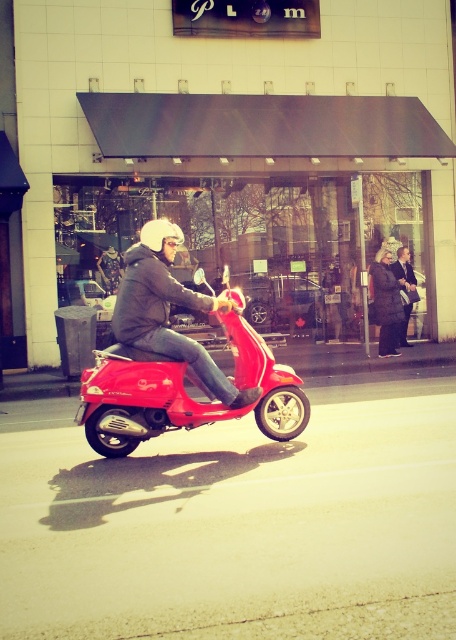
Which is more to the left, dark gray wool coat at center or leather jacket at center?

From the viewer's perspective, dark gray wool coat at center appears more on the left side.

Does dark gray wool coat at center have a larger size compared to leather jacket at center?

Correct, dark gray wool coat at center is larger in size than leather jacket at center.

Locate an element on the screen. dark gray wool coat at center is located at coordinates (387, 301).

Consider the image. Can you confirm if shiny red scooter at center is smaller than dark gray wool coat at center?

Correct, shiny red scooter at center occupies less space than dark gray wool coat at center.

Is shiny red scooter at center in front of dark gray wool coat at center?

That is True.

Find the location of a particular element. This screenshot has height=640, width=456. shiny red scooter at center is located at coordinates (184, 392).

Who is lower down, matte black helmet at upper center or leather jacket at center?

matte black helmet at upper center is lower down.

Does matte black helmet at upper center have a larger size compared to leather jacket at center?

Yes.

Between point (150, 282) and point (399, 269), which one is positioned behind?

The point (399, 269) is more distant.

Locate an element on the screen. The height and width of the screenshot is (640, 456). matte black helmet at upper center is located at coordinates (169, 310).